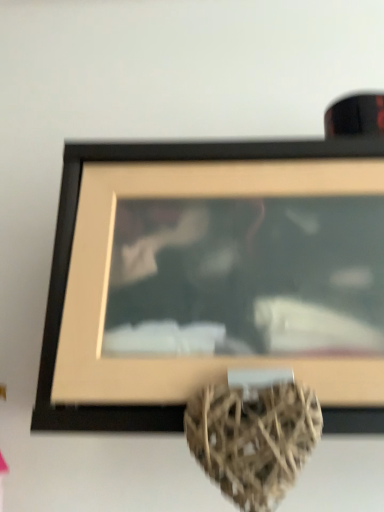
Question: Should I look upward or downward to see black matte picture frame at upper center?

Choices:
 (A) up
 (B) down

Answer: (B)